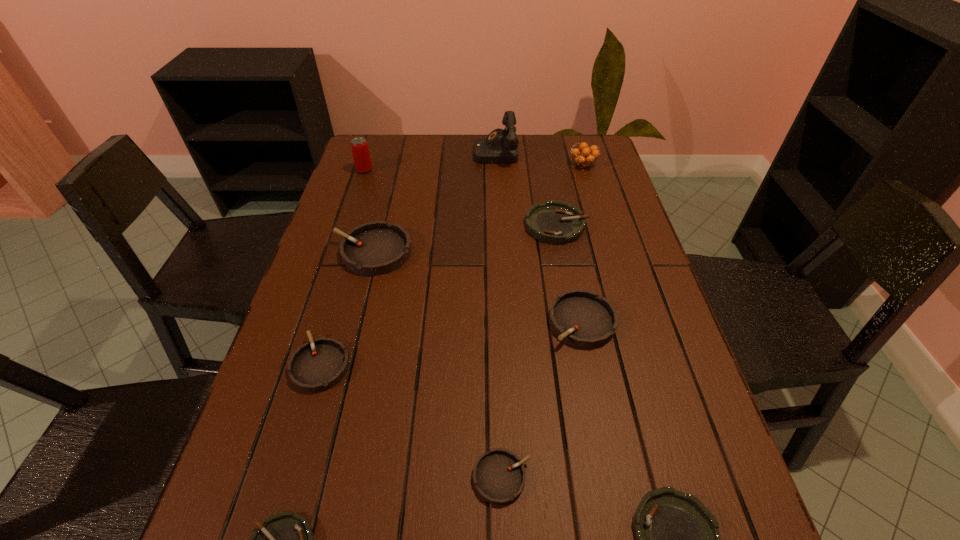
This screenshot has height=540, width=960. In order to click on free space that is in between the farthest green ashtray and the third tallest object in this screenshot , I will do pyautogui.click(x=570, y=195).

Locate an element on the screen. free space between the smallest gray ashtray and the second biggest gray ashtray is located at coordinates point(542,400).

Where is `the eighth closest object to the nearest gray ashtray`? This screenshot has width=960, height=540. the eighth closest object to the nearest gray ashtray is located at coordinates (583, 158).

At what (x,y) coordinates should I click in order to perform the action: click on object that is the third nearest to the ninth shortest object. Please return your answer as a coordinate pair (x, y). This screenshot has height=540, width=960. Looking at the image, I should click on (555, 222).

At what (x,y) coordinates should I click in order to perform the action: click on ashtray object that ranks as the third closest to the orange fruit. Please return your answer as a coordinate pair (x, y). Looking at the image, I should click on (375, 248).

You are a GUI agent. You are given a task and a screenshot of the screen. Output one action in this format:
    pyautogui.click(x=<x>, y=<y>)
    Task: Click on the closest ashtray relative to the smallest green ashtray
    
    Given the screenshot: What is the action you would take?
    pyautogui.click(x=318, y=365)

Point out which gray ashtray is positioned as the nearest to the second smallest gray ashtray. Please provide its 2D coordinates. Your answer should be formatted as a tuple, i.e. [(x, y)], where the tuple contains the x and y coordinates of a point satisfying the conditions above.

[(375, 248)]

This screenshot has width=960, height=540. What are the coordinates of `gray ashtray that stands as the closest to the biggest green ashtray` in the screenshot? It's located at click(x=581, y=318).

Identify which green ashtray is located as the nearest to the third tallest object. Please provide its 2D coordinates. Your answer should be formatted as a tuple, i.e. [(x, y)], where the tuple contains the x and y coordinates of a point satisfying the conditions above.

[(555, 222)]

Locate an element on the screen. The width and height of the screenshot is (960, 540). green ashtray that is the second closest to the shortest object is located at coordinates (555, 222).